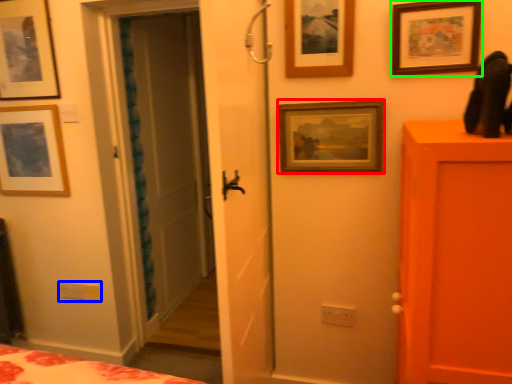
Question: Which object is positioned farthest from picture frame (highlighted by a red box)? Select from light switch (highlighted by a blue box) and picture frame (highlighted by a green box).

Choices:
 (A) light switch
 (B) picture frame

Answer: (A)